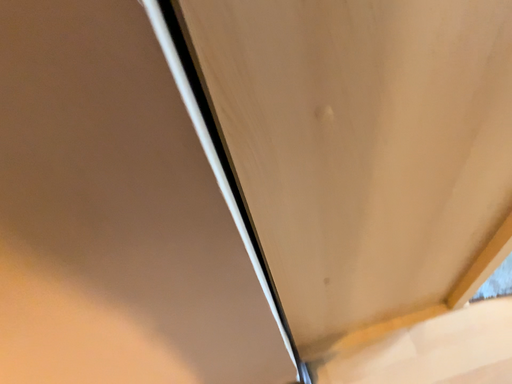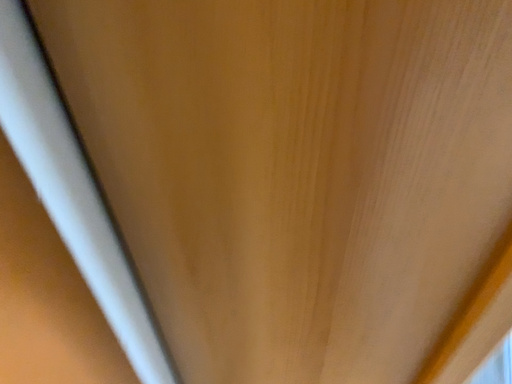
Question: Which way did the camera rotate in the video?

Choices:
 (A) rotated left
 (B) rotated right

Answer: (A)